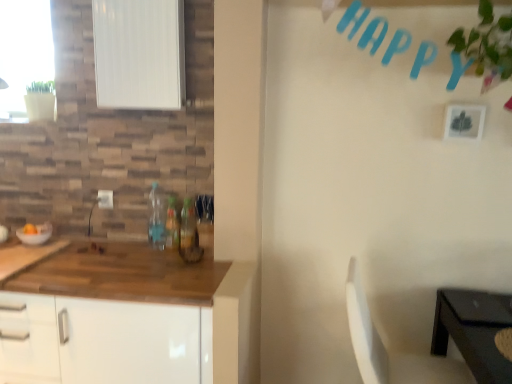
Question: Considering the positions of point (426, 362) and point (480, 127), is point (426, 362) closer or farther from the camera than point (480, 127)?

Choices:
 (A) farther
 (B) closer

Answer: (B)

Question: Based on their positions, is white plastic chair at lower right located to the left or right of white matte picture frame at upper right?

Choices:
 (A) left
 (B) right

Answer: (A)

Question: Estimate the real-world distances between objects in this image. Which object is farther from the white plastic chair at lower right?

Choices:
 (A) translucent plastic bottle at center, which is the 3th bottle from right to left
 (B) white matte cabinet at lower left
 (C) green leafy plant at upper right
 (D) white matte window screen at upper left
 (E) white matte picture frame at upper right

Answer: (D)

Question: Which of these objects is positioned farthest from the white matte cabinet at lower left?

Choices:
 (A) white plastic chair at lower right
 (B) white glossy bowl at left
 (C) white matte window screen at upper left
 (D) translucent plastic bottle at center, which is the 3th bottle from right to left
 (E) white matte picture frame at upper right

Answer: (E)